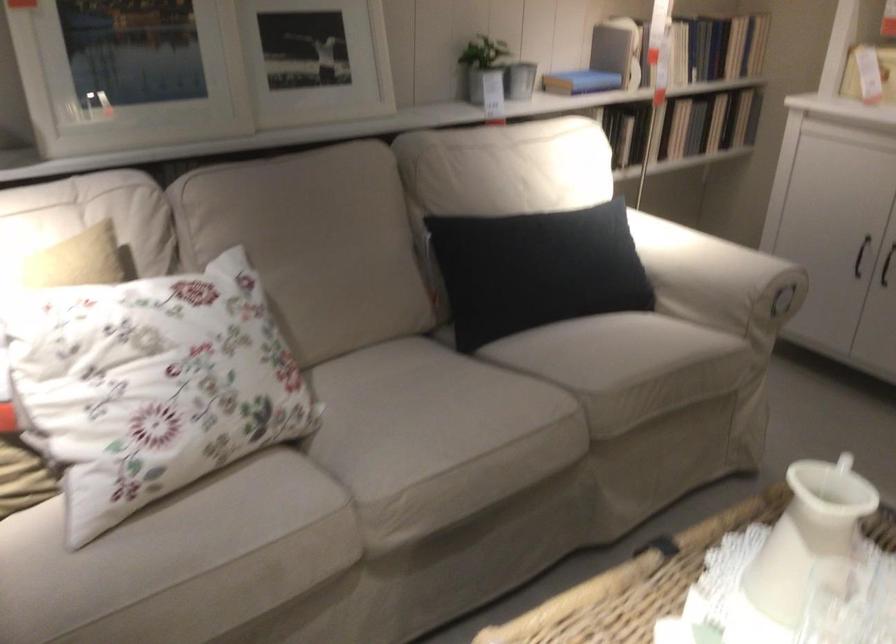
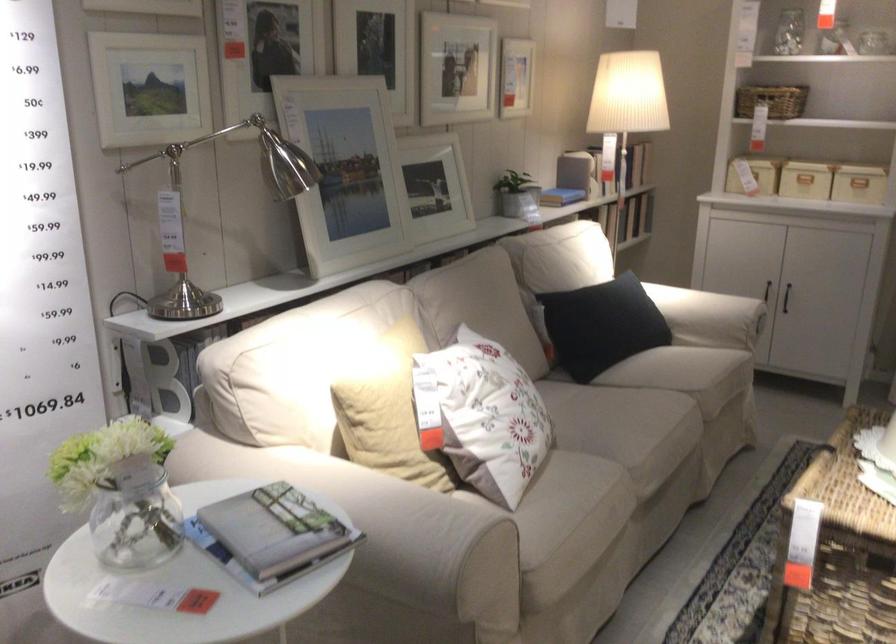
Locate, in the second image, the point that corresponds to point 357,447 in the first image.

(596, 442)